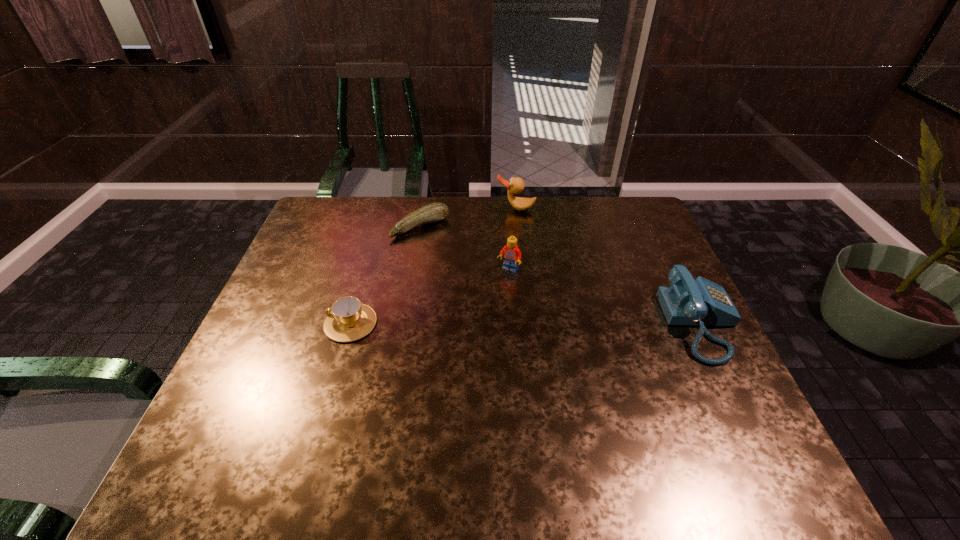
Locate an element on the screen. The image size is (960, 540). cup is located at coordinates (349, 320).

At what (x,y) coordinates should I click in order to perform the action: click on the rightmost object. Please return your answer as a coordinate pair (x, y). Looking at the image, I should click on (701, 302).

You are a GUI agent. You are given a task and a screenshot of the screen. Output one action in this format:
    pyautogui.click(x=<x>, y=<y>)
    Task: Click on the farthest object
    The height and width of the screenshot is (540, 960).
    Given the screenshot: What is the action you would take?
    pyautogui.click(x=516, y=185)

Find the location of a particular element. The image size is (960, 540). the second farthest object is located at coordinates (437, 211).

Where is `Lego`? This screenshot has width=960, height=540. Lego is located at coordinates point(512,255).

Where is `blank space located with the handle on the side of the cup`? This screenshot has width=960, height=540. blank space located with the handle on the side of the cup is located at coordinates (293, 323).

Identify the location of vacant area located with the handle on the side of the cup. The width and height of the screenshot is (960, 540). (285, 323).

Find the location of a particular element. vacant space located with the handle on the side of the cup is located at coordinates point(270,323).

Identify the location of free spot located 0.330m on the beak of the farthest object. Image resolution: width=960 pixels, height=540 pixels. (498, 278).

This screenshot has width=960, height=540. Identify the location of vacant space located on the beak of the farthest object. (509, 231).